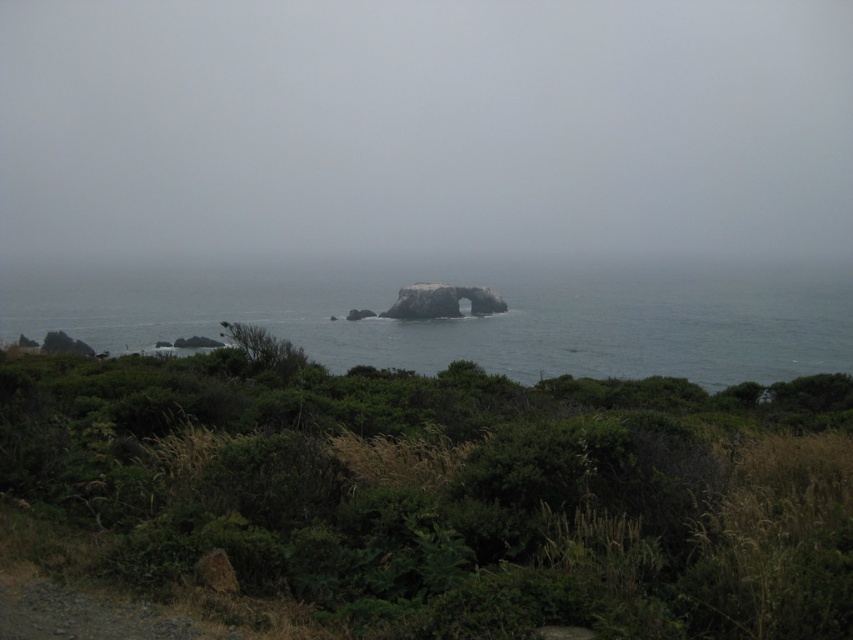
Question: Does green leafy shrubs at center have a greater width compared to gray rock at center?

Choices:
 (A) yes
 (B) no

Answer: (B)

Question: Is green leafy shrubs at center below gray rock at center?

Choices:
 (A) no
 (B) yes

Answer: (B)

Question: Does green leafy shrubs at center have a lesser width compared to gray rock at center?

Choices:
 (A) no
 (B) yes

Answer: (B)

Question: Among these objects, which one is nearest to the camera?

Choices:
 (A) green leafy shrubs at center
 (B) gray rock at center

Answer: (A)